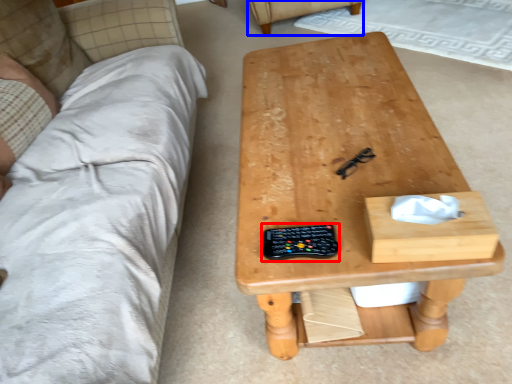
Question: Which object appears closest to the camera in this image, control (highlighted by a red box) or armchair (highlighted by a blue box)?

Choices:
 (A) control
 (B) armchair

Answer: (A)